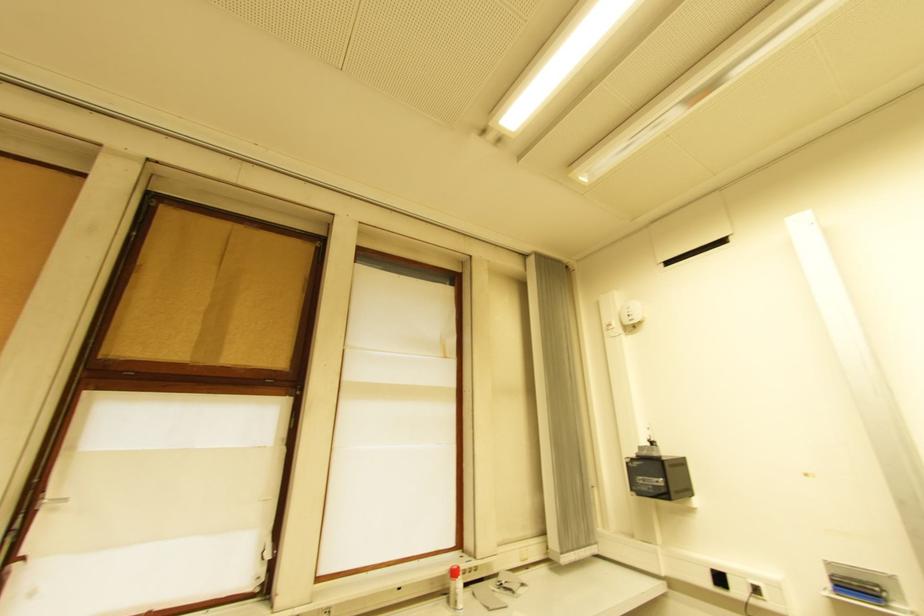
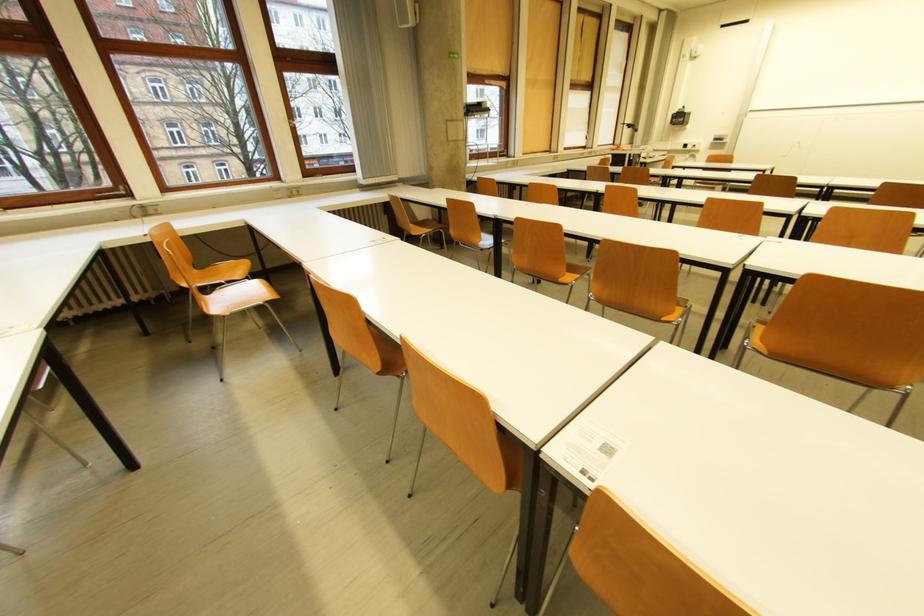
In the second image, find the point that corresponds to (x=727, y=581) in the first image.

(691, 147)